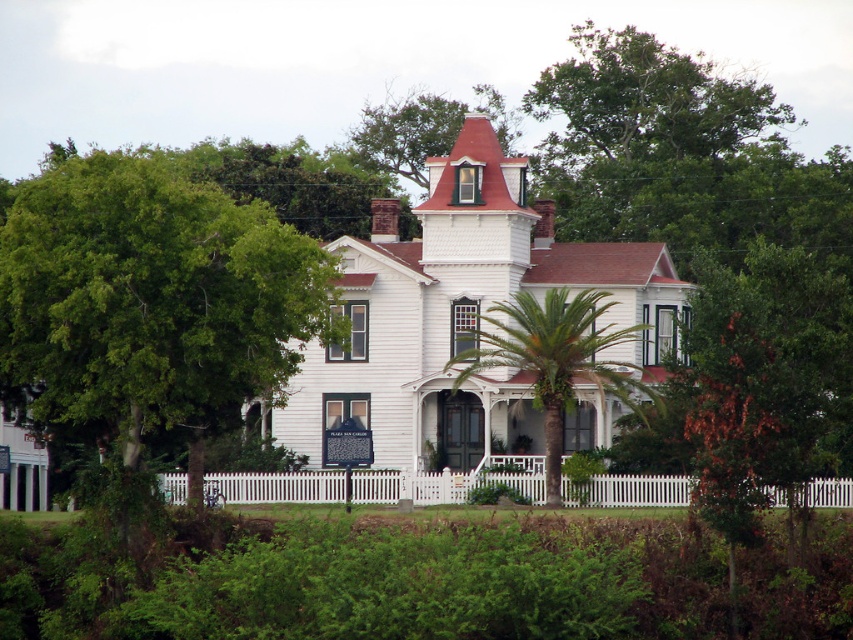
Question: Which point is closer to the camera?

Choices:
 (A) (28, 308)
 (B) (558, 289)

Answer: (A)

Question: Which of the following is the closest to the observer?

Choices:
 (A) green leafy palm tree at center
 (B) green leafy tree at lower left

Answer: (B)

Question: Is green leafy tree at lower left to the right of green leafy palm tree at center from the viewer's perspective?

Choices:
 (A) yes
 (B) no

Answer: (B)

Question: Where is green leafy tree at lower left located in relation to green leafy palm tree at center in the image?

Choices:
 (A) left
 (B) right

Answer: (A)

Question: Where is green leafy tree at lower left located in relation to green leafy palm tree at center in the image?

Choices:
 (A) above
 (B) below

Answer: (A)

Question: Among these objects, which one is nearest to the camera?

Choices:
 (A) green leafy palm tree at center
 (B) green leafy tree at lower left

Answer: (B)